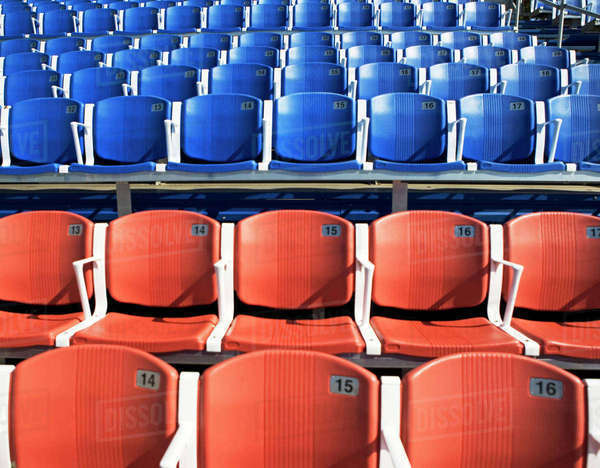
This screenshot has width=600, height=468. I want to click on red seats, so click(35, 240), click(174, 257), click(290, 248), click(468, 247), click(562, 248), click(485, 391), click(276, 405), click(100, 391).